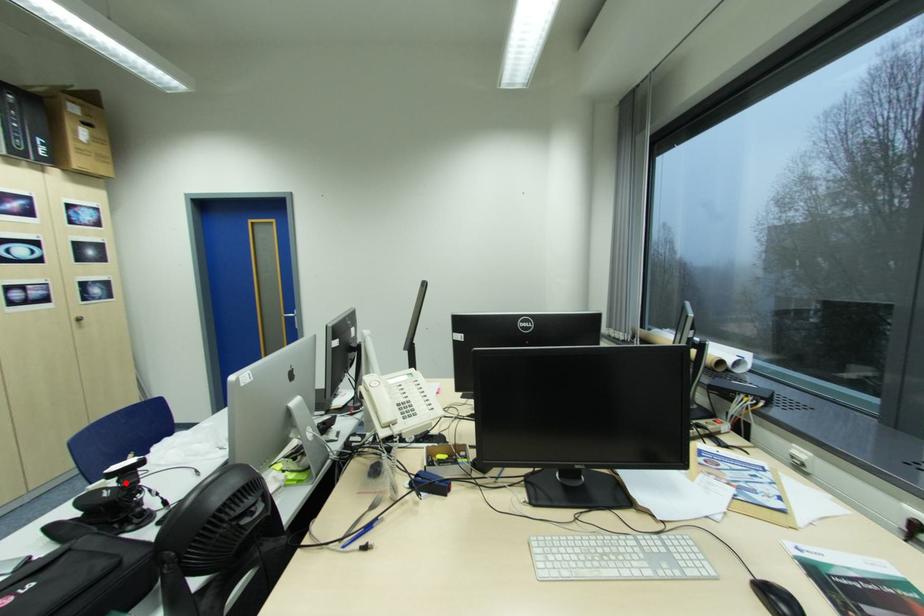
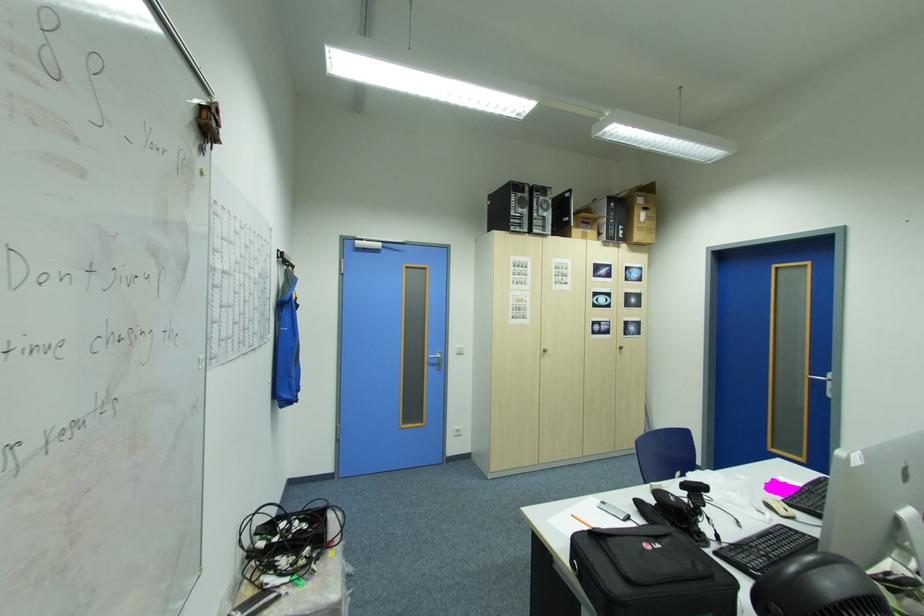
Question: I am providing you with two images of the same scene from different viewpoints. A red point is shown in image1. For the corresponding object point in image2, is it positioned nearer or farther from the camera?

Choices:
 (A) Nearer
 (B) Farther

Answer: (B)